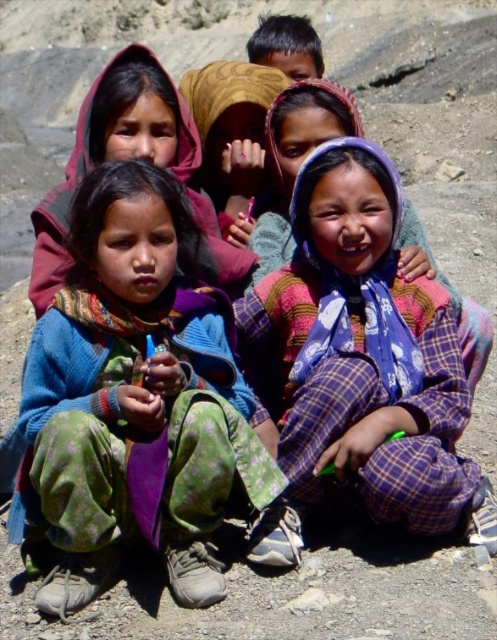
You are a photographer trying to capture a group photo of the plaid fabric child at center and the dark brown hair at upper center. Based on their sizes, which child should you position closer to the camera to ensure both appear equally sized in the photo?

Since the plaid fabric child at center is smaller than the dark brown hair at upper center, you should position the plaid fabric child at center closer to the camera to make them appear the same size as the dark brown hair at upper center in the photo.

You are a photographer trying to capture a closeup shot of the blue knitted sweater at center. Given that your camera can focus on objects within 2 meters, will you be able to take the closeup?

The blue knitted sweater at center is 21.61 meters from the camera, which is much farther than the 2 meter focus range. You will not be able to take a closeup with this distance.